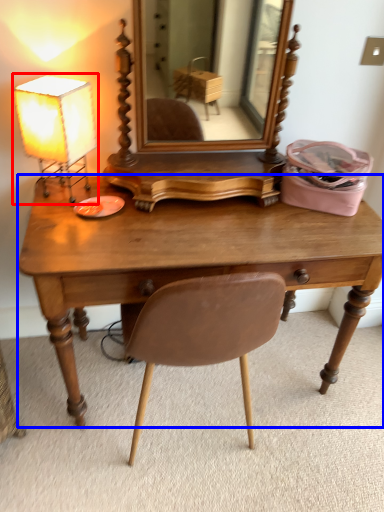
Question: Which of the following is the farthest to the observer, lamp (highlighted by a red box) or desk (highlighted by a blue box)?

Choices:
 (A) lamp
 (B) desk

Answer: (A)